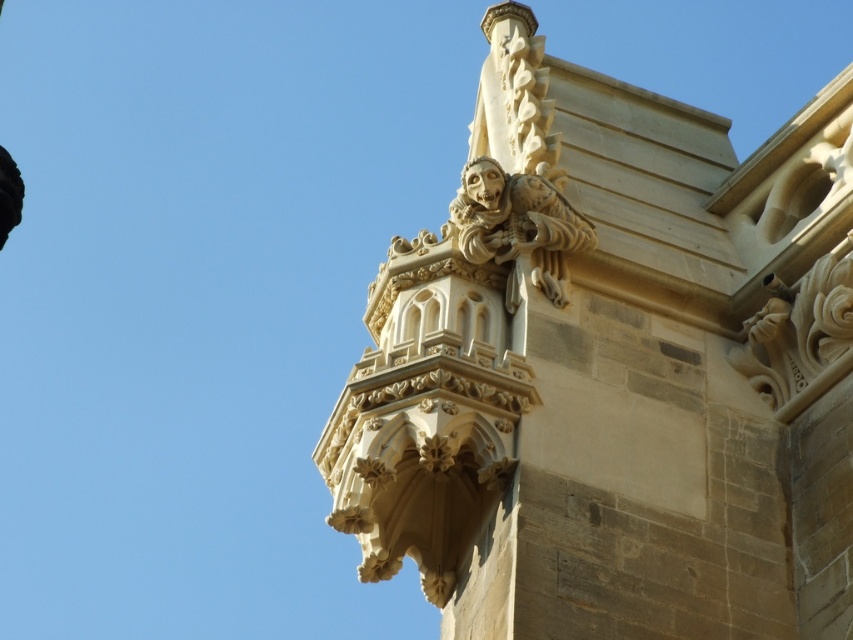
You are standing on the ground floor of the building depicted in the image. You want to locate the beige stone gargoyle at upper right. According to the coordinates provided, where should you look relative to your position?

The beige stone gargoyle at upper right is located at coordinates point (613, 371), which means it is positioned to the upper right relative to your standing position on the ground floor.

You are an architect examining the building facade. You notice two beige stone gargoyles on the upper part of the structure. Which one is closer to you, the beige stone gargoyle at upper right or the beige stone gargoyle at upper center?

The beige stone gargoyle at upper right is closer to you because it is positioned in front of the beige stone gargoyle at upper center.